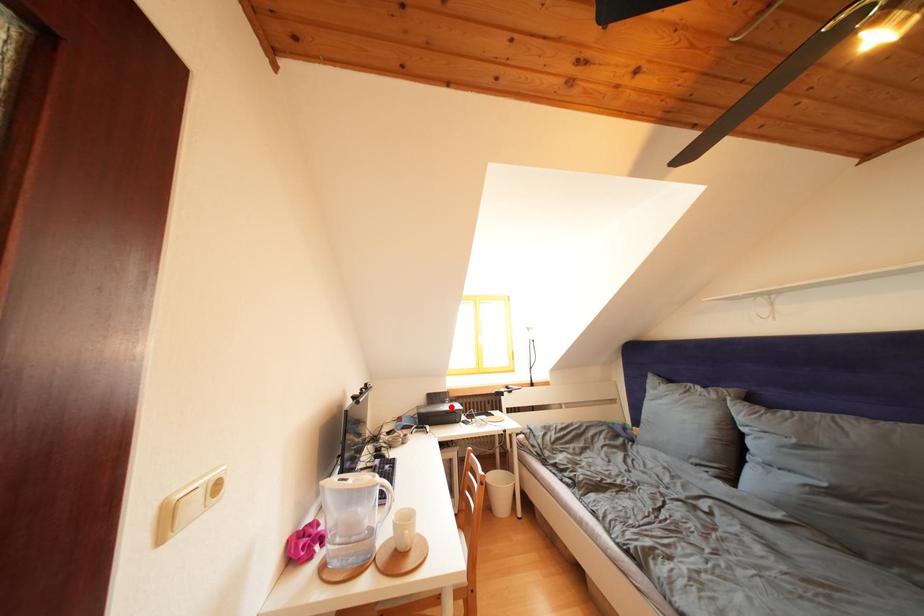
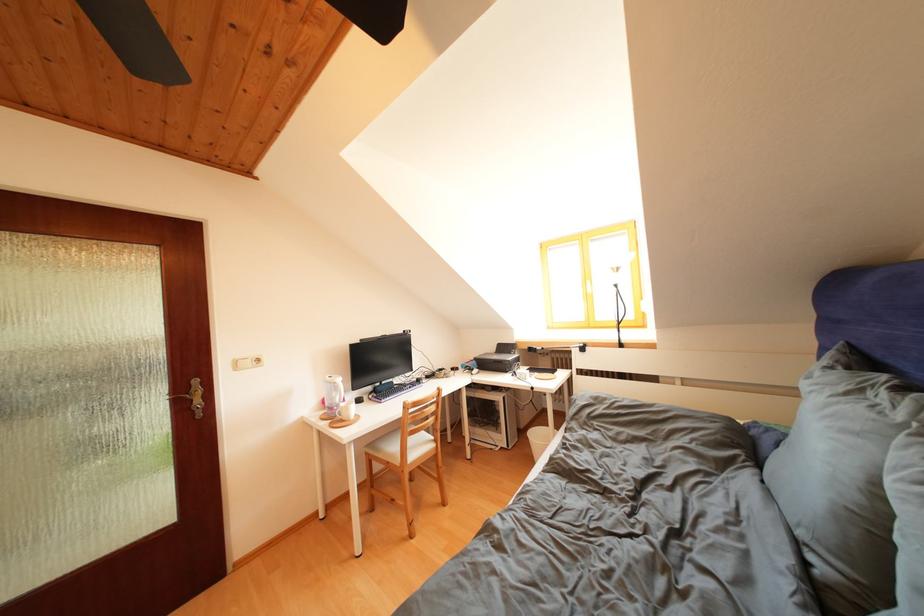
In the second image, find the point that corresponds to the highlighted location in the first image.

(517, 358)